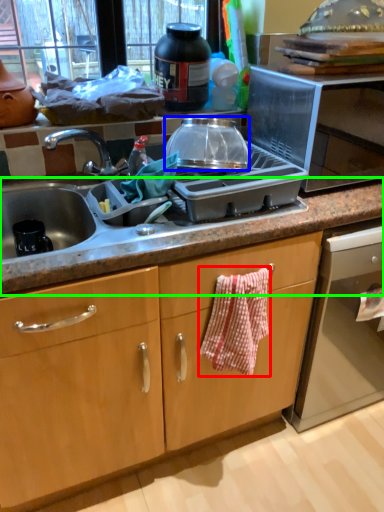
Question: Based on their relative distances, which object is nearer to hand towel (highlighted by a red box)? Choose from kitchen appliance (highlighted by a blue box) and countertop (highlighted by a green box).

Choices:
 (A) kitchen appliance
 (B) countertop

Answer: (B)